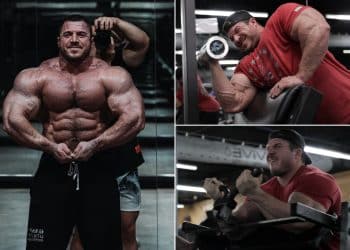
Locate an element on the screen. The height and width of the screenshot is (250, 350). cushion is located at coordinates (268, 109).